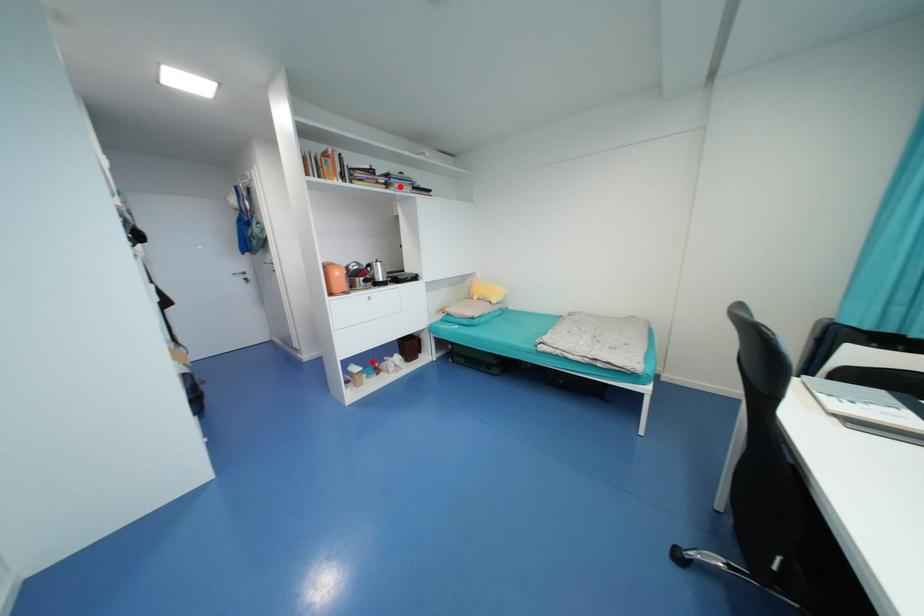
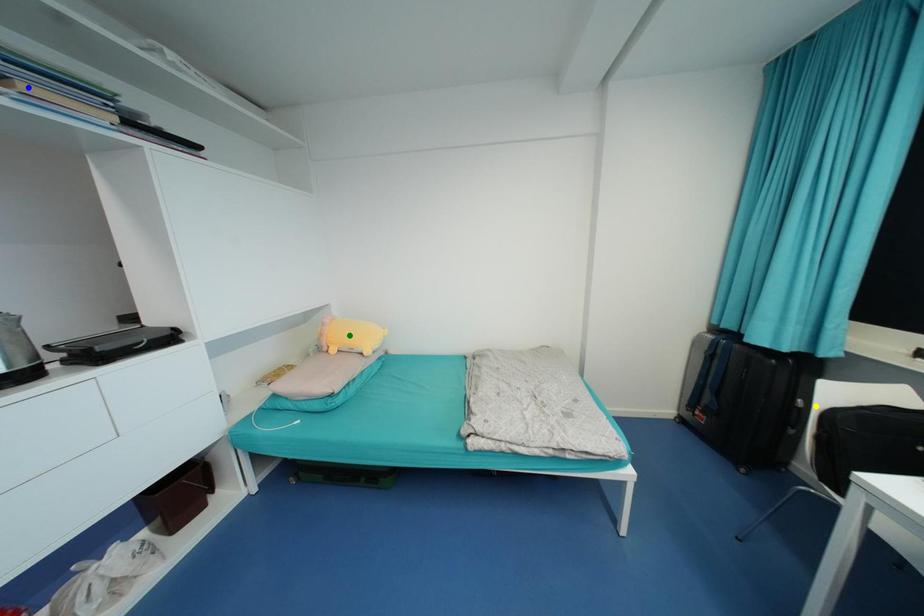
Question: I am providing you with two images of the same scene from different viewpoints. A red point is marked on the first image. You are given multiple points on the second image. Which point in image 2 is actually the same real-world point as the red point in image 1?

Choices:
 (A) blue point
 (B) yellow point
 (C) green point

Answer: (A)